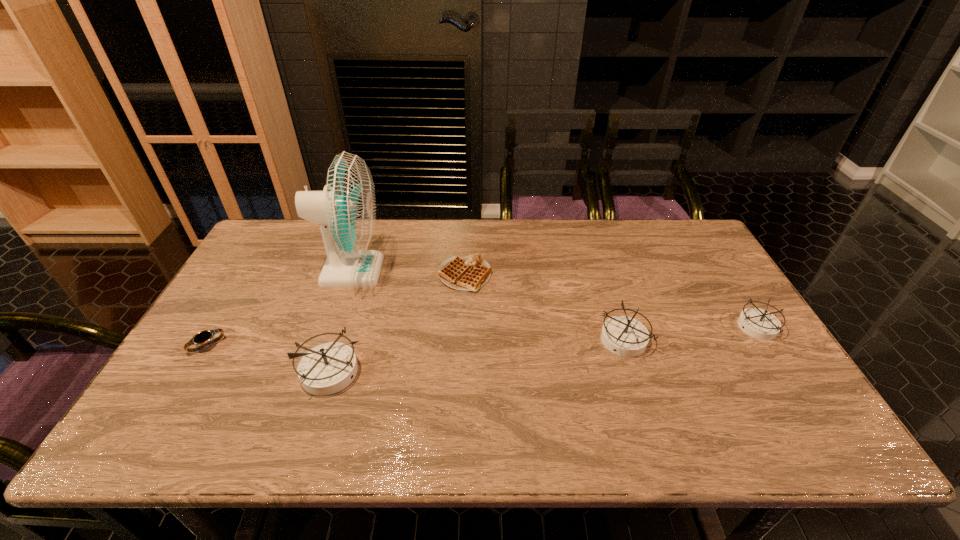
Where is `spot to insert another compass for uniform distribution`? spot to insert another compass for uniform distribution is located at coordinates (482, 355).